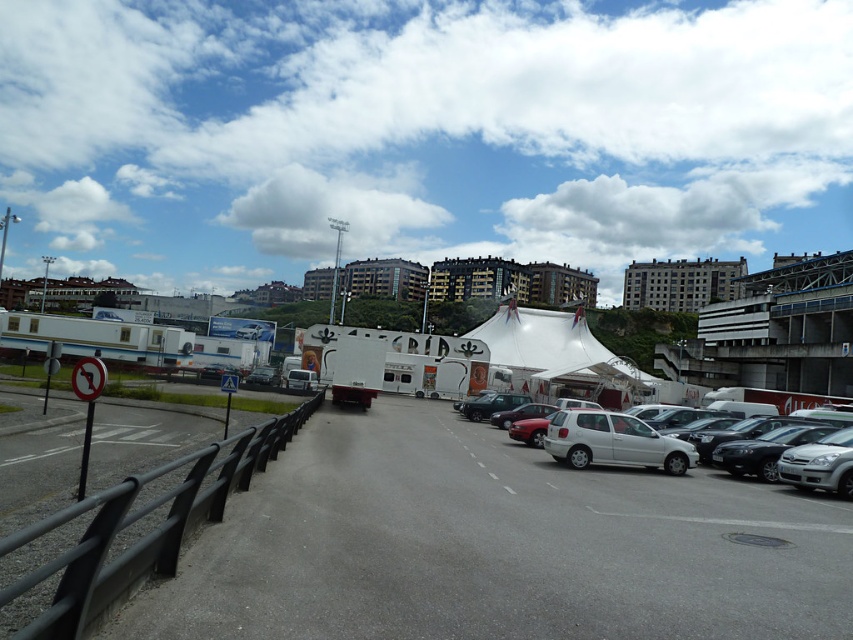
Who is more forward, (660, 438) or (248, 340)?

Point (660, 438) is more forward.

Does white matte hatchback at lower right have a smaller size compared to white matte trailer at left?

Yes, white matte hatchback at lower right is smaller than white matte trailer at left.

You are a GUI agent. You are given a task and a screenshot of the screen. Output one action in this format:
    pyautogui.click(x=<x>, y=<y>)
    Task: Click on the white matte hatchback at lower right
    This screenshot has height=640, width=853.
    Given the screenshot: What is the action you would take?
    pyautogui.click(x=663, y=442)

Which is more to the right, white matte hatchback at lower right or black matte van at center?

white matte hatchback at lower right is more to the right.

Is point (589, 452) positioned in front of point (262, 378)?

Yes, point (589, 452) is in front of point (262, 378).

Identify the location of white matte hatchback at lower right. (663, 442).

Which is more to the right, white canvas tent at center or matte red car at center?

white canvas tent at center

In the scene shown: Is white canvas tent at center shorter than matte red car at center?

No.

Describe the element at coordinates (560, 356) in the screenshot. The height and width of the screenshot is (640, 853). I see `white canvas tent at center` at that location.

You are a GUI agent. You are given a task and a screenshot of the screen. Output one action in this format:
    pyautogui.click(x=<x>, y=<y>)
    Task: Click on the white canvas tent at center
    This screenshot has width=853, height=640.
    Given the screenshot: What is the action you would take?
    tap(560, 356)